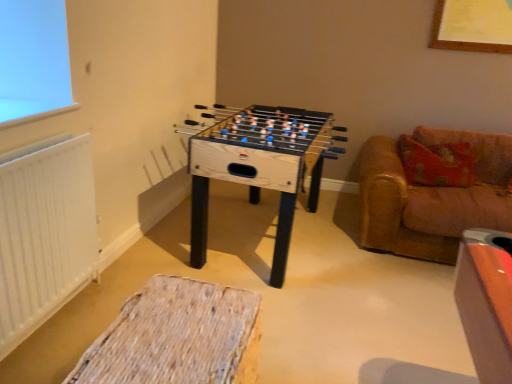
Question: From the image's perspective, is natural wood foosball table at center beneath white matte radiator at left?

Choices:
 (A) yes
 (B) no

Answer: (B)

Question: From the image's perspective, is natural wood foosball table at center over white matte radiator at left?

Choices:
 (A) yes
 (B) no

Answer: (A)

Question: Considering the relative sizes of natural wood foosball table at center and white matte radiator at left in the image provided, is natural wood foosball table at center taller than white matte radiator at left?

Choices:
 (A) yes
 (B) no

Answer: (B)

Question: Is natural wood foosball table at center at the right side of white matte radiator at left?

Choices:
 (A) no
 (B) yes

Answer: (B)

Question: Can we say natural wood foosball table at center lies outside white matte radiator at left?

Choices:
 (A) no
 (B) yes

Answer: (B)

Question: From their relative heights in the image, would you say woven fabric ottoman at lower center is taller or shorter than leather couch at right?

Choices:
 (A) tall
 (B) short

Answer: (B)

Question: From a real-world perspective, relative to leather couch at right, is woven fabric ottoman at lower center vertically above or below?

Choices:
 (A) below
 (B) above

Answer: (A)

Question: Is woven fabric ottoman at lower center spatially inside leather couch at right, or outside of it?

Choices:
 (A) outside
 (B) inside

Answer: (A)

Question: Is woven fabric ottoman at lower center bigger or smaller than leather couch at right?

Choices:
 (A) big
 (B) small

Answer: (B)

Question: From the image's perspective, is natural wood foosball table at center above or below white matte radiator at left?

Choices:
 (A) above
 (B) below

Answer: (A)

Question: From a real-world perspective, is natural wood foosball table at center positioned above or below white matte radiator at left?

Choices:
 (A) below
 (B) above

Answer: (A)

Question: Is natural wood foosball table at center spatially inside white matte radiator at left, or outside of it?

Choices:
 (A) outside
 (B) inside

Answer: (A)

Question: In the image, is natural wood foosball table at center on the left side or the right side of white matte radiator at left?

Choices:
 (A) left
 (B) right

Answer: (B)

Question: From a real-world perspective, relative to natural wood foosball table at center, is leather couch at right vertically above or below?

Choices:
 (A) above
 (B) below

Answer: (B)

Question: Is leather couch at right spatially inside natural wood foosball table at center, or outside of it?

Choices:
 (A) outside
 (B) inside

Answer: (A)